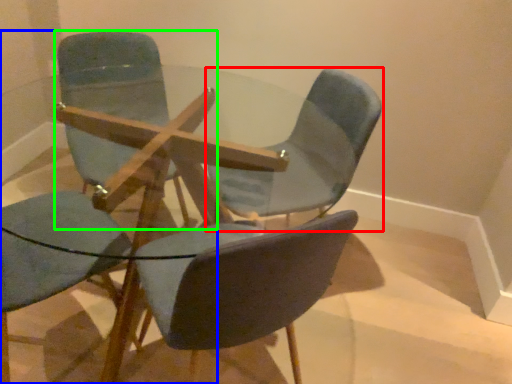
Question: Which is nearer to the chair (highlighted by a red box)? chair (highlighted by a blue box) or chair (highlighted by a green box).

Choices:
 (A) chair
 (B) chair

Answer: (A)